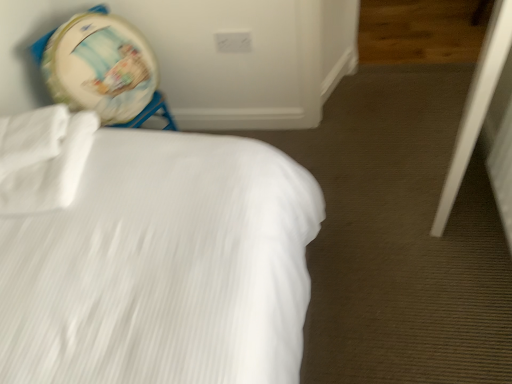
Measure the distance between white matte sheet at upper left and camera.

white matte sheet at upper left and camera are 3.36 feet apart from each other.

What do you see at coordinates (42, 158) in the screenshot?
I see `white matte sheet at upper left` at bounding box center [42, 158].

Locate an element on the screen. This screenshot has height=384, width=512. white matte sheet at upper left is located at coordinates (42, 158).

Is white matte sheet at upper left smaller than wooden textured drum at upper left?

Indeed, white matte sheet at upper left has a smaller size compared to wooden textured drum at upper left.

Which object is positioned more to the left, white matte sheet at upper left or wooden textured drum at upper left?

white matte sheet at upper left.

Image resolution: width=512 pixels, height=384 pixels. In the image, there is a wooden textured drum at upper left. Identify the location of sheet below it (from the image's perspective). pos(42,158).

Between white plastic screen door at lower right and wooden textured drum at upper left, which one appears on the left side from the viewer's perspective?

Positioned to the left is wooden textured drum at upper left.

Is white plastic screen door at lower right oriented towards wooden textured drum at upper left?

Yes, white plastic screen door at lower right is aimed at wooden textured drum at upper left.

Based on the photo, which point is more distant from viewer, (449,210) or (116,53)?

The point (116,53) is behind.

Looking at the image, does wooden textured drum at upper left seem bigger or smaller compared to white matte sheet at upper left?

Clearly, wooden textured drum at upper left is larger in size than white matte sheet at upper left.

Which point is more distant from viewer, (135,109) or (1,189)?

The point (135,109) is farther.

From a real-world perspective, does wooden textured drum at upper left sit lower than white matte sheet at upper left?

Yes, from a real-world perspective, wooden textured drum at upper left is below white matte sheet at upper left.

Is wooden textured drum at upper left not within white textured bed at upper left?

Absolutely, wooden textured drum at upper left is external to white textured bed at upper left.

Is wooden textured drum at upper left oriented away from white textured bed at upper left?

No.

Between wooden textured drum at upper left and white textured bed at upper left, which one has larger size?

white textured bed at upper left is bigger.

Are wooden textured drum at upper left and white textured bed at upper left far apart?

No.

Is white textured bed at upper left located outside white matte sheet at upper left?

white textured bed at upper left is positioned outside white matte sheet at upper left.

From the image's perspective, would you say white textured bed at upper left is shown under white matte sheet at upper left?

Indeed, from the image's perspective, white textured bed at upper left is shown beneath white matte sheet at upper left.

Which object is thinner, white textured bed at upper left or white matte sheet at upper left?

With smaller width is white matte sheet at upper left.

Between point (18, 186) and point (499, 38), which one is positioned behind?

The point (18, 186) is farther from the camera.

Consider the image. Which is more to the left, white matte sheet at upper left or white plastic screen door at lower right?

white matte sheet at upper left.

From the image's perspective, is white matte sheet at upper left located above or below white plastic screen door at lower right?

white matte sheet at upper left is below white plastic screen door at lower right.

Which of these two, white matte sheet at upper left or white plastic screen door at lower right, is bigger?

With larger size is white plastic screen door at lower right.

Based on their sizes in the image, would you say white matte sheet at upper left is bigger or smaller than white textured bed at upper left?

white matte sheet at upper left is smaller than white textured bed at upper left.

Considering the positions of point (32, 172) and point (207, 298), is point (32, 172) closer or farther from the camera than point (207, 298)?

Clearly, point (32, 172) is more distant from the camera than point (207, 298).

Are white matte sheet at upper left and white textured bed at upper left beside each other?

No, white matte sheet at upper left is not next to white textured bed at upper left.

The height and width of the screenshot is (384, 512). In the image, there is a white matte sheet at upper left. Identify the location of swivel chair below it (from a real-world perspective). (102, 69).

Find the location of `swivel chair above the white plastic screen door at lower right (from a real-world perspective)`. swivel chair above the white plastic screen door at lower right (from a real-world perspective) is located at coordinates (102, 69).

Considering their positions, is white matte sheet at upper left positioned further to white plastic screen door at lower right than white textured bed at upper left?

white matte sheet at upper left lies further to white plastic screen door at lower right than the other object.

Which object lies nearer to the anchor point wooden textured drum at upper left, white textured bed at upper left or white plastic screen door at lower right?

Among the two, white textured bed at upper left is located nearer to wooden textured drum at upper left.

From the image, which object appears to be farther from white plastic screen door at lower right, white textured bed at upper left or white matte sheet at upper left?

Among the two, white matte sheet at upper left is located further to white plastic screen door at lower right.

Estimate the real-world distances between objects in this image. Which object is closer to white matte sheet at upper left, white textured bed at upper left or wooden textured drum at upper left?

white textured bed at upper left is closer to white matte sheet at upper left.

Which object lies further to the anchor point wooden textured drum at upper left, white plastic screen door at lower right or white matte sheet at upper left?

white plastic screen door at lower right.

From the image, which object appears to be nearer to white textured bed at upper left, white plastic screen door at lower right or white matte sheet at upper left?

The object closer to white textured bed at upper left is white matte sheet at upper left.

Based on their spatial positions, is white matte sheet at upper left or white plastic screen door at lower right closer to wooden textured drum at upper left?

white matte sheet at upper left lies closer to wooden textured drum at upper left than the other object.

Consider the image. Based on their spatial positions, is wooden textured drum at upper left or white plastic screen door at lower right closer to white textured bed at upper left?

wooden textured drum at upper left lies closer to white textured bed at upper left than the other object.

The height and width of the screenshot is (384, 512). Identify the location of sheet positioned between white textured bed at upper left and wooden textured drum at upper left from near to far. (42, 158).

Identify the location of swivel chair located between white matte sheet at upper left and white plastic screen door at lower right in the left-right direction. This screenshot has height=384, width=512. (102, 69).

Locate an element on the screen. The height and width of the screenshot is (384, 512). bed located between white matte sheet at upper left and white plastic screen door at lower right in the left-right direction is located at coordinates (149, 255).

You are a GUI agent. You are given a task and a screenshot of the screen. Output one action in this format:
    pyautogui.click(x=<x>, y=<y>)
    Task: Click on the bed between wooden textured drum at upper left and white plastic screen door at lower right
    This screenshot has width=512, height=384.
    Given the screenshot: What is the action you would take?
    pyautogui.click(x=149, y=255)